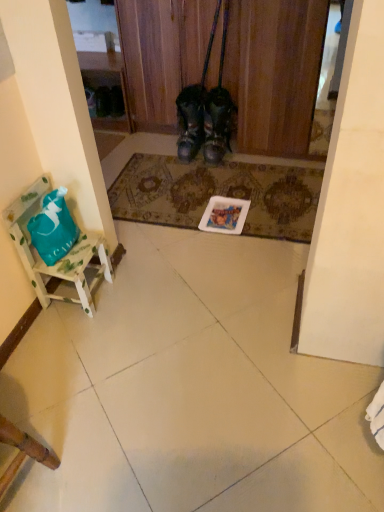
This screenshot has width=384, height=512. I want to click on vacant area that is in front of leather boots at center, the second footwear viewed from the right, so click(x=185, y=167).